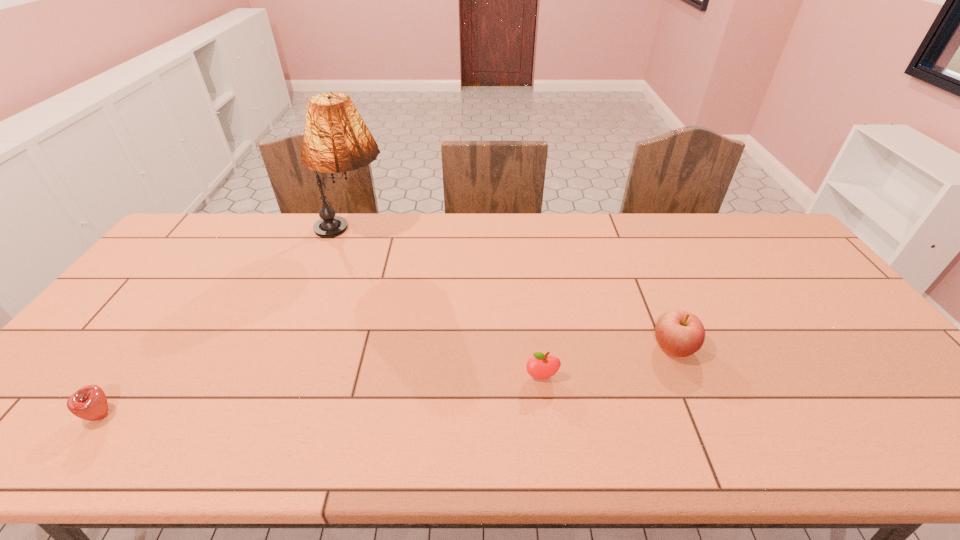
Find the location of a particular element. The height and width of the screenshot is (540, 960). free spot that satisfies the following two spatial constraints: 1. on the front-facing side of the farthest object; 2. on the front side of the leftmost object is located at coordinates (284, 415).

Identify the location of free point that satisfies the following two spatial constraints: 1. on the front-facing side of the second apple from left to right; 2. on the left side of the farthest object. (299, 377).

This screenshot has height=540, width=960. Find the location of `free point that satisfies the following two spatial constraints: 1. on the front-facing side of the rightmost apple; 2. on the left side of the lampshade`. free point that satisfies the following two spatial constraints: 1. on the front-facing side of the rightmost apple; 2. on the left side of the lampshade is located at coordinates (309, 348).

The width and height of the screenshot is (960, 540). I want to click on vacant area that satisfies the following two spatial constraints: 1. on the front-facing side of the second apple from left to right; 2. on the right side of the lampshade, so click(x=299, y=377).